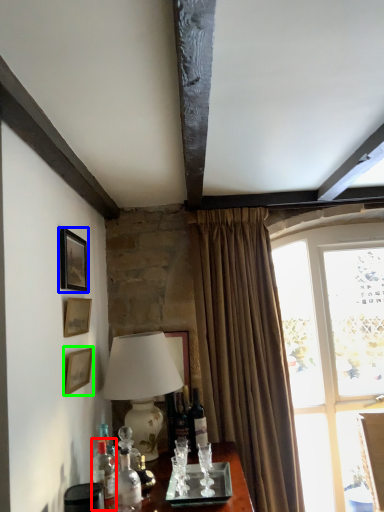
Question: Which object is the farthest from bottle (highlighted by a red box)? Choose among these: picture frame (highlighted by a blue box) or picture frame (highlighted by a green box).

Choices:
 (A) picture frame
 (B) picture frame

Answer: (A)